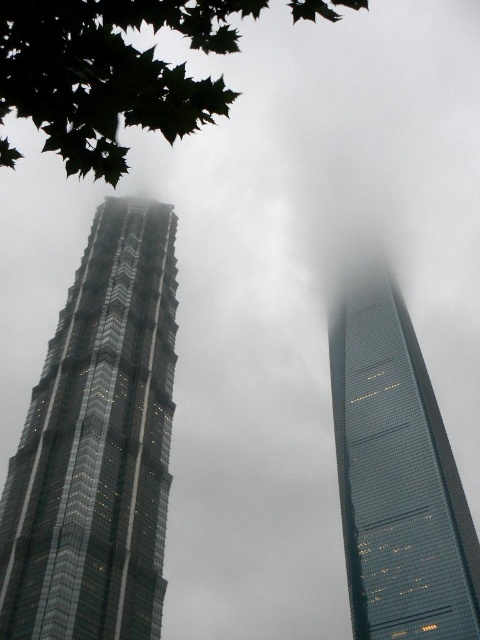
You are an architect planning to install a large billboard between the glassy metallic skyscraper at left and the green leafy tree at upper left. Considering their sizes, which object would require more adjustments to accommodate the billboard?

The glassy metallic skyscraper at left has a smaller size compared to the green leafy tree at upper left. Therefore, the billboard would need to be adjusted to fit around the larger green leafy tree at upper left.

You are standing at the point marked as point (97, 444) in the image. Which skyscraper is directly in front of you?

The glassy metallic skyscraper at left is located at point (97, 444), so it is directly in front of you.

In the scene shown: You are a drone operator trying to navigate between the glassy metallic skyscraper at left and the green leafy tree at upper left. According to the scene, which object is positioned to the right of the other?

The glassy metallic skyscraper at left is to the right of the green leafy tree at upper left.